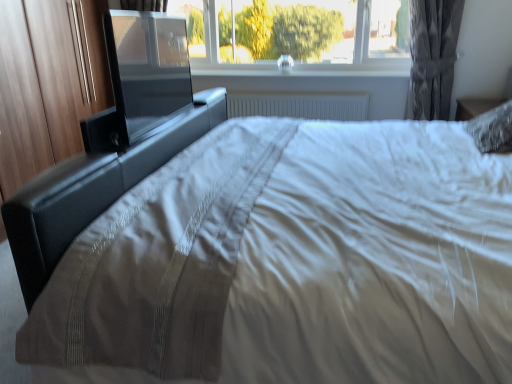
The width and height of the screenshot is (512, 384). Identify the location of vacant point above white plastic radiator at center (from a real-world perspective). (284, 94).